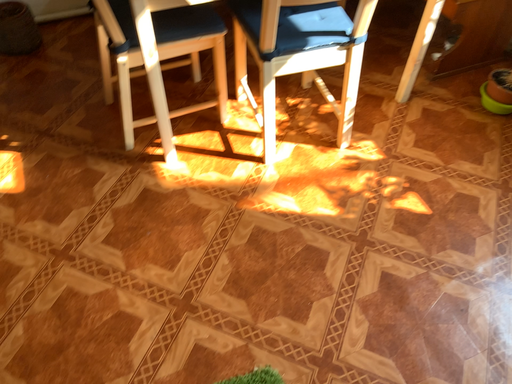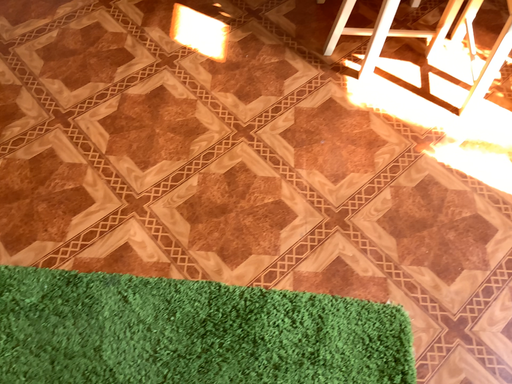
Question: Which way did the camera rotate in the video?

Choices:
 (A) rotated upward
 (B) rotated downward

Answer: (B)